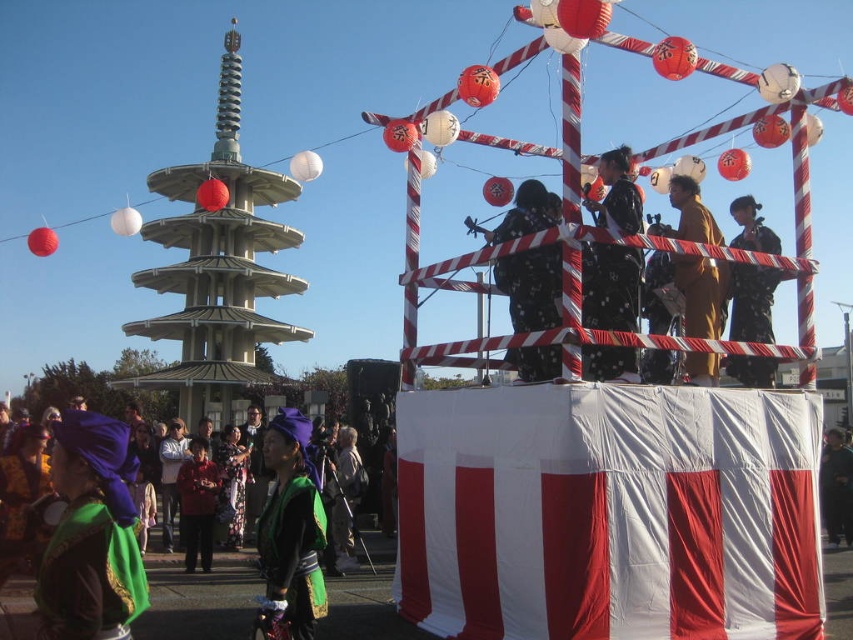
Question: Is black satin kimono at center above brown textured kimono at center?

Choices:
 (A) no
 (B) yes

Answer: (B)

Question: Which point is closer to the camera?

Choices:
 (A) (340, 456)
 (B) (722, 276)
 (C) (631, 257)
 (D) (842, 445)

Answer: (C)

Question: Which object is positioned farthest from the brown textured kimono at center?

Choices:
 (A) black satin kimono at center
 (B) velvet green robe at lower left
 (C) dark green fabric at center
 (D) black kimono at center

Answer: (C)

Question: Is velvet green robe at lower left closer to the viewer compared to dark gray fabric at center?

Choices:
 (A) yes
 (B) no

Answer: (A)

Question: From the image, what is the correct spatial relationship of black kimono at center in relation to dark green fabric at center?

Choices:
 (A) left
 (B) right

Answer: (A)

Question: Which of the following is the farthest from the observer?

Choices:
 (A) (337, 509)
 (B) (201, 566)

Answer: (A)